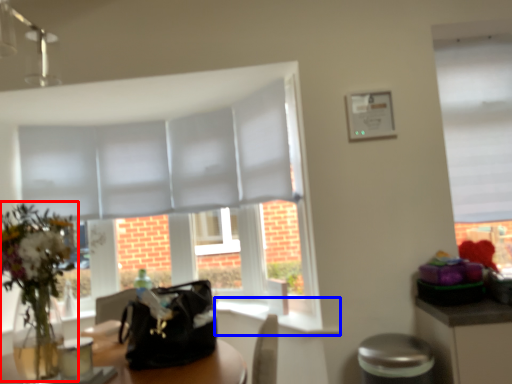
Question: Which of the following is the closest to the observer, floral arrangement (highlighted by a red box) or window sill (highlighted by a blue box)?

Choices:
 (A) floral arrangement
 (B) window sill

Answer: (A)